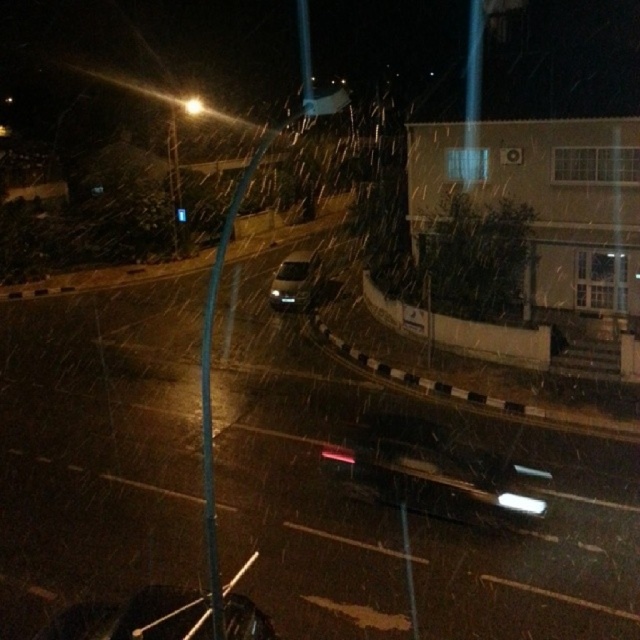
Question: Which object is closer to the camera taking this photo?

Choices:
 (A) metallic silver car at center
 (B) sleek silver sedan at center

Answer: (A)

Question: Which point is farther to the camera?

Choices:
 (A) (500, 504)
 (B) (179, 218)
 (C) (326, 108)
 (D) (184, 609)

Answer: (B)

Question: Does shiny black car at lower left come behind metallic pole at upper center?

Choices:
 (A) yes
 (B) no

Answer: (B)

Question: Which point appears closest to the camera in this image?

Choices:
 (A) (147, 612)
 (B) (483, 460)

Answer: (A)

Question: In this image, where is shiny black car at lower left located relative to metallic pole at upper center?

Choices:
 (A) left
 (B) right

Answer: (B)

Question: Is sleek silver sedan at center thinner than blue glass traffic light at upper center?

Choices:
 (A) no
 (B) yes

Answer: (A)